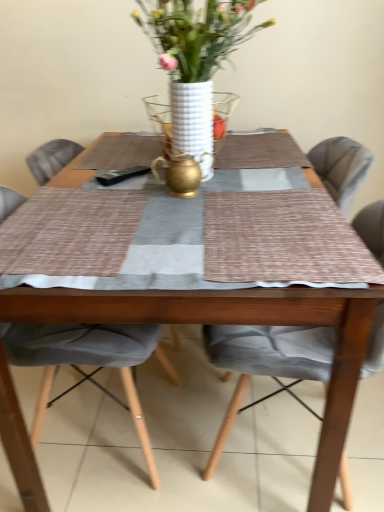
Where is `empty space that is to the right of white textured vase at center`? Image resolution: width=384 pixels, height=512 pixels. empty space that is to the right of white textured vase at center is located at coordinates (259, 160).